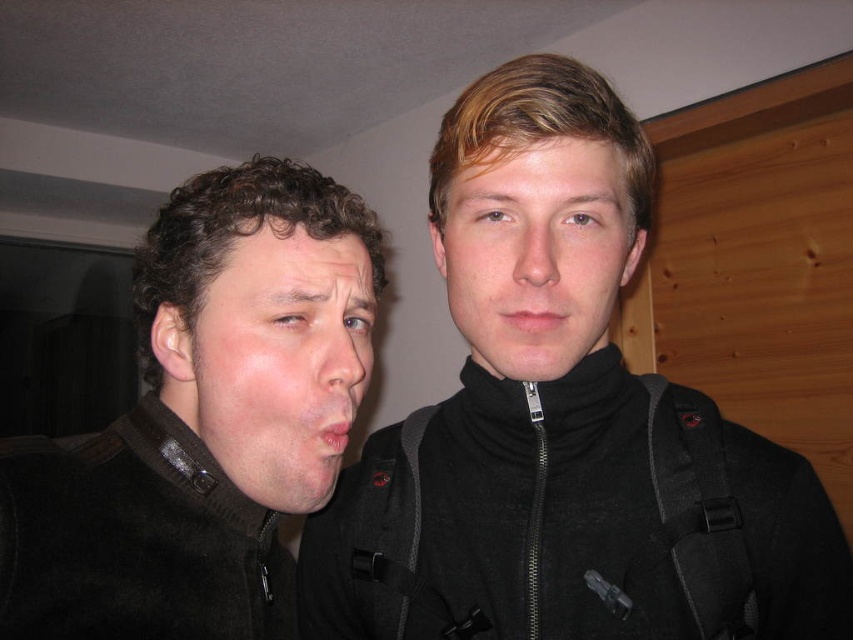
Question: Is matte black face at left thinner than smooth skin face at center?

Choices:
 (A) yes
 (B) no

Answer: (A)

Question: From the image, what is the correct spatial relationship of smooth skin face at center in relation to matte black mouth at center?

Choices:
 (A) left
 (B) right

Answer: (B)

Question: Among these objects, which one is farthest from the camera?

Choices:
 (A) black matte jacket at upper right
 (B) dark brown sweater at left

Answer: (A)

Question: Which is farther from the black matte jacket at upper right?

Choices:
 (A) dry matte lips at center
 (B) smooth skin face at center
 (C) matte black mouth at center
 (D) dark brown sweater at left

Answer: (A)

Question: Which point is closer to the camera?

Choices:
 (A) (761, 486)
 (B) (186, 284)

Answer: (B)

Question: In this image, where is matte black mouth at center located relative to dry matte lips at center?

Choices:
 (A) below
 (B) above

Answer: (B)